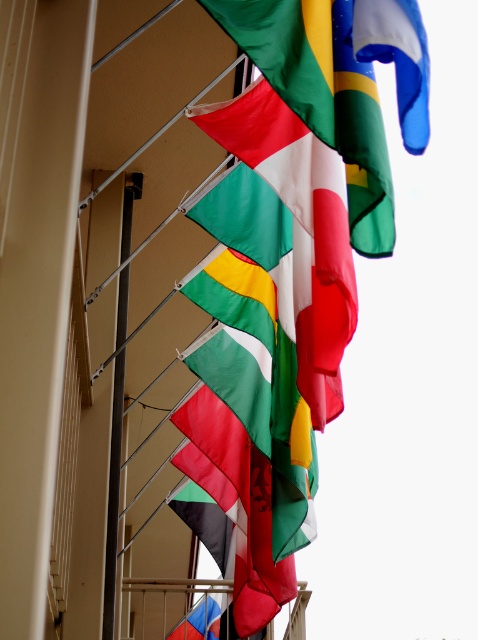
Between polyester flag at center and silver metallic pole at center, which one has less height?

Standing shorter between the two is polyester flag at center.

Is point (333, 36) positioned before point (127, 182)?

Yes.

Find the location of a particular element. polyester flag at center is located at coordinates (324, 96).

Is textured fabric flag at center in front of silver metallic pole at center?

Yes, it is in front of silver metallic pole at center.

Which is behind, point (328, 195) or point (126, 264)?

The point (126, 264) is behind.

Which is in front, point (262, 173) or point (127, 214)?

Point (262, 173) is more forward.

This screenshot has height=640, width=478. Identify the location of textured fabric flag at center. (289, 228).

Is point (283, 218) farther from viewer compared to point (303, 76)?

Yes.

What do you see at coordinates (289, 228) in the screenshot? I see `textured fabric flag at center` at bounding box center [289, 228].

Who is more distant from viewer, (288, 188) or (330, 45)?

The point (288, 188) is more distant.

You are a GUI agent. You are given a task and a screenshot of the screen. Output one action in this format:
    pyautogui.click(x=<x>, y=<y>)
    Task: Click on the textured fabric flag at center
    The height and width of the screenshot is (640, 478).
    Given the screenshot: What is the action you would take?
    pyautogui.click(x=289, y=228)